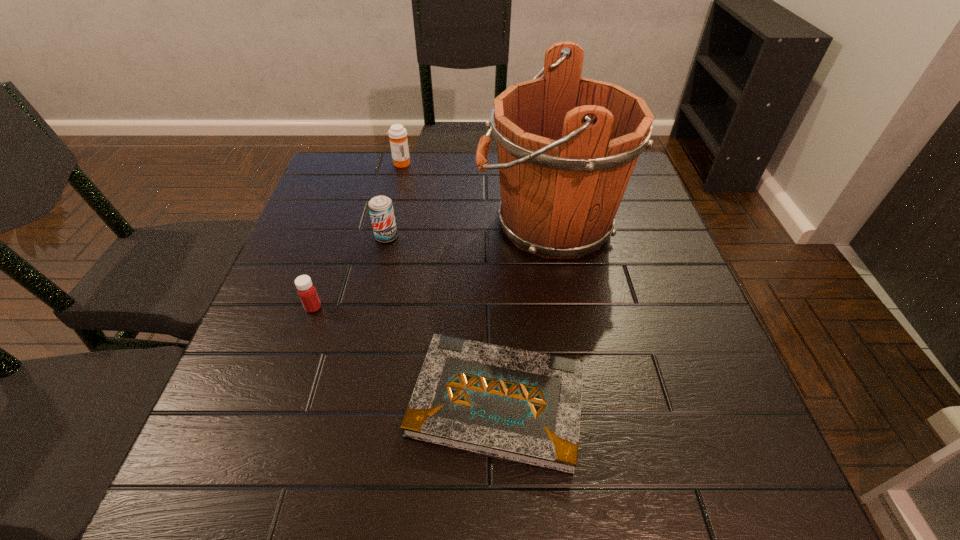
This screenshot has height=540, width=960. Identify the location of vacant space situated with the handle on the side of the bucket. (430, 224).

The height and width of the screenshot is (540, 960). I want to click on vacant space located 0.080m on the front of the farthest object, so coord(396,183).

The height and width of the screenshot is (540, 960). Find the location of `vacant area situated on the left of the beer can`. vacant area situated on the left of the beer can is located at coordinates (319, 237).

Locate an element on the screen. vacant space situated 0.100m on the right of the second nearest object is located at coordinates (369, 307).

Locate an element on the screen. vacant space located 0.150m on the left of the nearest object is located at coordinates (324, 402).

In order to click on bucket that is at the far edge in this screenshot , I will do `click(567, 146)`.

Where is `medicine located in the far edge section of the desktop`? The width and height of the screenshot is (960, 540). medicine located in the far edge section of the desktop is located at coordinates (398, 134).

Find the location of a particular element. object at the near edge is located at coordinates (522, 406).

Locate an element on the screen. object that is at the left edge is located at coordinates (307, 292).

Image resolution: width=960 pixels, height=540 pixels. What are the coordinates of `object at the right edge` in the screenshot? It's located at (567, 146).